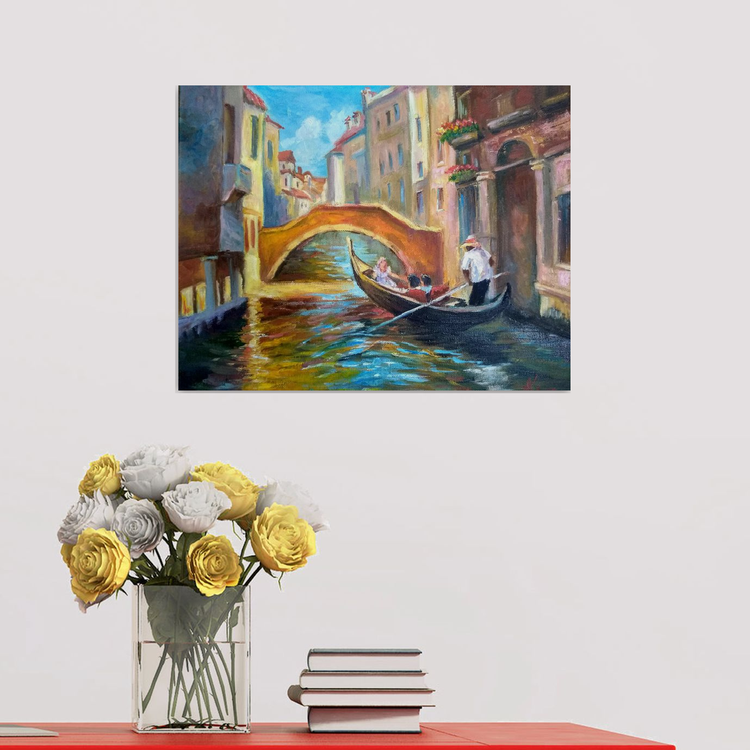
Identify the location of wall. The image size is (750, 750). (655, 349).